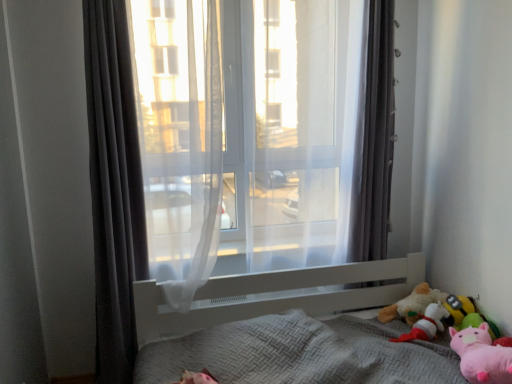
This screenshot has height=384, width=512. What do you see at coordinates (467, 315) in the screenshot?
I see `pink plush toy at lower right, the fourth toy when ordered from back to front` at bounding box center [467, 315].

Find the location of `translucent fabric at center`. translucent fabric at center is located at coordinates (244, 140).

The width and height of the screenshot is (512, 384). What are the coordinates of `dark gray fabric curtain at right, arranged as the first curtain when viewed from the right` in the screenshot? It's located at (374, 139).

Does point (459, 309) come closer to viewer compared to point (94, 230)?

Yes, it is.

From the image's perspective, is soft plush toy at lower right, the 2th toy in the back-to-front sequence, on top of translucent fabric at center?

No, from the image's perspective, soft plush toy at lower right, the 2th toy in the back-to-front sequence, is not over translucent fabric at center.

Is soft plush toy at lower right, the 3th toy when ordered from front to back, to the left of translucent fabric at center from the viewer's perspective?

In fact, soft plush toy at lower right, the 3th toy when ordered from front to back, is to the right of translucent fabric at center.

In the scene shown: Can you tell me how much soft plush toy at lower right, the 2th toy in the back-to-front sequence, and translucent fabric at center differ in facing direction?

88.9 degrees.

Which is behind, fluffy white stuffed animal at lower right, arranged as the second toy when viewed from the front, or soft plush toy at lower right, the 2th toy in the back-to-front sequence?

soft plush toy at lower right, the 2th toy in the back-to-front sequence, is further away from the camera.

Is fluffy white stuffed animal at lower right, acting as the third toy starting from the back, looking in the opposite direction of soft plush toy at lower right, the 2th toy in the back-to-front sequence?

Yes, fluffy white stuffed animal at lower right, acting as the third toy starting from the back, is positioned with its back facing soft plush toy at lower right, the 2th toy in the back-to-front sequence.

You are a GUI agent. You are given a task and a screenshot of the screen. Output one action in this format:
    pyautogui.click(x=<x>, y=<y>)
    Task: Click on the 1st toy directly beneath the fluffy white stuffed animal at lower right, arranged as the second toy when viewed from the front (from a real-world perspective)
    The image size is (512, 384).
    Given the screenshot: What is the action you would take?
    tap(458, 309)

From the image's perspective, is fluffy white stuffed animal at lower right, arranged as the second toy when viewed from the front, below soft plush toy at lower right, the 3th toy when ordered from front to back?

Indeed, from the image's perspective, fluffy white stuffed animal at lower right, arranged as the second toy when viewed from the front, is shown beneath soft plush toy at lower right, the 3th toy when ordered from front to back.

How much distance is there between soft plush toy at lower right, the 3th toy when ordered from front to back, and pink plush toy at lower right?

soft plush toy at lower right, the 3th toy when ordered from front to back, is 9.80 centimeters away from pink plush toy at lower right.

Locate an element on the screen. The image size is (512, 384). the 3rd toy behind the pink plush toy at lower right is located at coordinates (458, 309).

Is soft plush toy at lower right, the 2th toy in the back-to-front sequence, not within pink plush toy at lower right?

soft plush toy at lower right, the 2th toy in the back-to-front sequence, is positioned outside pink plush toy at lower right.

Relative to pink plush toy at lower right, is soft plush toy at lower right, the 3th toy when ordered from front to back, in front or behind?

In the image, soft plush toy at lower right, the 3th toy when ordered from front to back, appears behind pink plush toy at lower right.

From the image's perspective, between textured gray bed at lower right and soft plush toy at lower right, the 2th toy in the back-to-front sequence, who is located below?

textured gray bed at lower right.

Is textured gray bed at lower right positioned beyond the bounds of soft plush toy at lower right, the 3th toy when ordered from front to back?

Absolutely, textured gray bed at lower right is external to soft plush toy at lower right, the 3th toy when ordered from front to back.

Is dark gray fabric curtain at right, arranged as the first curtain when viewed from the right, further to the viewer compared to pink plush toy at lower right, the fourth toy when ordered from back to front?

Yes, the depth of dark gray fabric curtain at right, arranged as the first curtain when viewed from the right, is greater than that of pink plush toy at lower right, the fourth toy when ordered from back to front.

Would you say dark gray fabric curtain at right, arranged as the first curtain when viewed from the right, is outside pink plush toy at lower right, which is the first toy from front to back?

Yes.

Find the location of a particular element. the 4th toy counting from the right side of the dark gray fabric curtain at right, which is the second curtain in left-to-right order is located at coordinates (467, 315).

From a real-world perspective, is dark gray fabric curtain at right, which is the second curtain in left-to-right order, positioned over pink plush toy at lower right, which is the first toy from front to back, based on gravity?

Yes, from a real-world perspective, dark gray fabric curtain at right, which is the second curtain in left-to-right order, is over pink plush toy at lower right, which is the first toy from front to back

Considering the points (87, 21) and (423, 309), which point is behind, point (87, 21) or point (423, 309)?

Positioned behind is point (423, 309).

Which toy is the 2nd one when counting from the right side of the dark gray fabric curtain at left, placed as the 2th curtain when sorted from right to left? Please provide its 2D coordinates.

[(412, 304)]

Is dark gray fabric curtain at left, the first curtain from the left, completely or partially outside of fluffy plush toy at lower right, placed as the fourth toy when sorted from front to back?

Absolutely, dark gray fabric curtain at left, the first curtain from the left, is external to fluffy plush toy at lower right, placed as the fourth toy when sorted from front to back.

From a real-world perspective, which is physically below, dark gray fabric curtain at left, the first curtain from the left, or fluffy plush toy at lower right, which is the first toy from back to front?

fluffy plush toy at lower right, which is the first toy from back to front, is physically lower.

Is pink plush toy at lower right, the fourth toy when ordered from back to front, taller or shorter than fluffy plush toy at lower right, placed as the fourth toy when sorted from front to back?

pink plush toy at lower right, the fourth toy when ordered from back to front, is shorter than fluffy plush toy at lower right, placed as the fourth toy when sorted from front to back.

Does pink plush toy at lower right, which is the first toy from front to back, come behind fluffy plush toy at lower right, which is the first toy from back to front?

No.

From the image's perspective, would you say pink plush toy at lower right, which is the first toy from front to back, is positioned over fluffy plush toy at lower right, which is the first toy from back to front?

Actually, pink plush toy at lower right, which is the first toy from front to back, appears below fluffy plush toy at lower right, which is the first toy from back to front, in the image.

Could you measure the distance between pink plush toy at lower right, the fourth toy when ordered from back to front, and fluffy plush toy at lower right, placed as the fourth toy when sorted from front to back?

pink plush toy at lower right, the fourth toy when ordered from back to front, and fluffy plush toy at lower right, placed as the fourth toy when sorted from front to back, are 16.93 centimeters apart from each other.

From a real-world perspective, starting from the translucent fabric at center, which toy is the 3rd one below it? Please provide its 2D coordinates.

[(458, 309)]

Where is `the 1st toy positioned below the soft plush toy at lower right, the 3th toy when ordered from front to back (from the image's perspective)`? This screenshot has width=512, height=384. the 1st toy positioned below the soft plush toy at lower right, the 3th toy when ordered from front to back (from the image's perspective) is located at coordinates (426, 324).

Considering their positions, is dark gray fabric curtain at left, the first curtain from the left, positioned further to translucent fabric at center than pink plush toy at lower right?

Based on the image, pink plush toy at lower right appears to be further to translucent fabric at center.

From the image, which object appears to be nearer to dark gray fabric curtain at left, placed as the 2th curtain when sorted from right to left, soft plush toy at lower right, the 3th toy when ordered from front to back, or pink plush toy at lower right, which is the first toy from front to back?

pink plush toy at lower right, which is the first toy from front to back, is closer to dark gray fabric curtain at left, placed as the 2th curtain when sorted from right to left.

Looking at the image, which one is located further to dark gray fabric curtain at right, which is the second curtain in left-to-right order, soft plush toy at lower right, the 3th toy when ordered from front to back, or fluffy plush toy at lower right, placed as the fourth toy when sorted from front to back?

soft plush toy at lower right, the 3th toy when ordered from front to back.

Looking at the image, which one is located closer to fluffy plush toy at lower right, which is the first toy from back to front, dark gray fabric curtain at right, arranged as the first curtain when viewed from the right, or soft plush toy at lower right, the 2th toy in the back-to-front sequence?

soft plush toy at lower right, the 2th toy in the back-to-front sequence, lies closer to fluffy plush toy at lower right, which is the first toy from back to front, than the other object.

Estimate the real-world distances between objects in this image. Which object is further from soft plush toy at lower right, the 3th toy when ordered from front to back, dark gray fabric curtain at right, arranged as the first curtain when viewed from the right, or translucent fabric at center?

translucent fabric at center.

Estimate the real-world distances between objects in this image. Which object is closer to soft plush toy at lower right, the 3th toy when ordered from front to back, dark gray fabric curtain at left, the first curtain from the left, or fluffy plush toy at lower right, placed as the fourth toy when sorted from front to back?

fluffy plush toy at lower right, placed as the fourth toy when sorted from front to back.

Which object lies further to the anchor point pink plush toy at lower right, translucent fabric at center or dark gray fabric curtain at right, arranged as the first curtain when viewed from the right?

translucent fabric at center is positioned further to the anchor pink plush toy at lower right.

Looking at the image, which one is located further to soft plush toy at lower right, the 3th toy when ordered from front to back, fluffy white stuffed animal at lower right, arranged as the second toy when viewed from the front, or fluffy plush toy at lower right, placed as the fourth toy when sorted from front to back?

fluffy plush toy at lower right, placed as the fourth toy when sorted from front to back, is positioned further to the anchor soft plush toy at lower right, the 3th toy when ordered from front to back.

Where is `curtain between dark gray fabric curtain at left, placed as the 2th curtain when sorted from right to left, and fluffy white stuffed animal at lower right, acting as the third toy starting from the back, from left to right`? The image size is (512, 384). curtain between dark gray fabric curtain at left, placed as the 2th curtain when sorted from right to left, and fluffy white stuffed animal at lower right, acting as the third toy starting from the back, from left to right is located at coordinates point(374,139).

Where is `window located between dark gray fabric curtain at left, placed as the 2th curtain when sorted from right to left, and fluffy white stuffed animal at lower right, arranged as the second toy when viewed from the front, in the left-right direction`? This screenshot has height=384, width=512. window located between dark gray fabric curtain at left, placed as the 2th curtain when sorted from right to left, and fluffy white stuffed animal at lower right, arranged as the second toy when viewed from the front, in the left-right direction is located at coordinates (244, 140).

Where is `stuff between textured gray bed at lower right and fluffy plush toy at lower right, which is the first toy from back to front, along the z-axis`? stuff between textured gray bed at lower right and fluffy plush toy at lower right, which is the first toy from back to front, along the z-axis is located at coordinates tap(420, 313).

Find the location of a particular element. The image size is (512, 384). window between dark gray fabric curtain at left, the first curtain from the left, and fluffy plush toy at lower right, which is the first toy from back to front, in the horizontal direction is located at coordinates (244, 140).